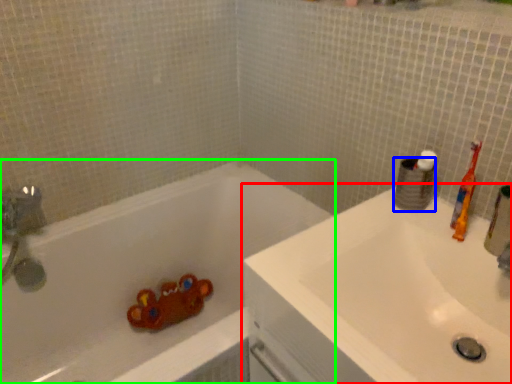
Question: Which object is positioned closest to sink (highlighted by a red box)? Select from toilet paper (highlighted by a blue box) and bathtub (highlighted by a green box).

Choices:
 (A) toilet paper
 (B) bathtub

Answer: (A)